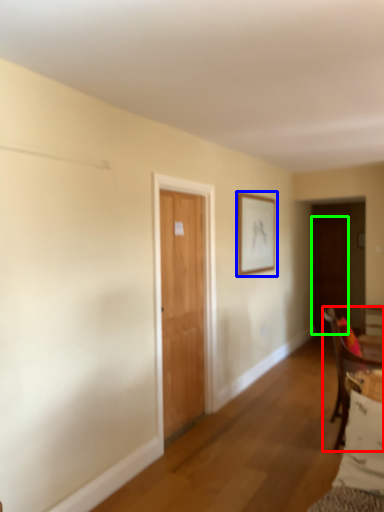
Question: Which object is positioned farthest from chair (highlighted by a red box)? Select from picture frame (highlighted by a blue box) and door (highlighted by a green box).

Choices:
 (A) picture frame
 (B) door

Answer: (B)